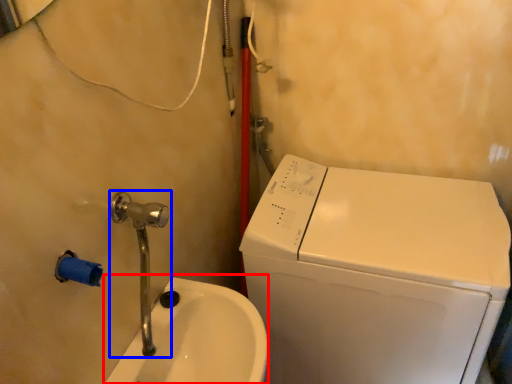
Question: Which of the following is the farthest to the observer, sink (highlighted by a red box) or plumbing fixture (highlighted by a blue box)?

Choices:
 (A) sink
 (B) plumbing fixture

Answer: (A)